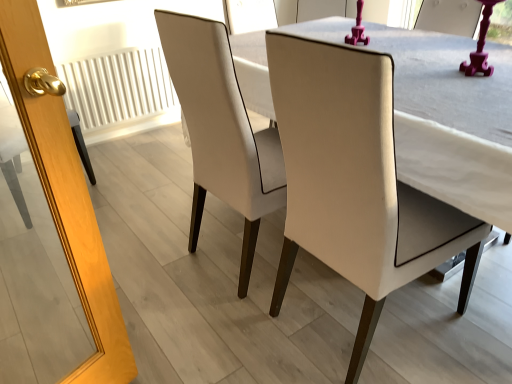
Question: Does point (73, 102) appear closer or farther from the camera than point (228, 152)?

Choices:
 (A) farther
 (B) closer

Answer: (A)

Question: From the image's perspective, is white textured radiator at left positioned above or below white leather chair at center, which is the 2th chair in right-to-left order?

Choices:
 (A) below
 (B) above

Answer: (B)

Question: Which is nearer to the white leather chair at center, arranged as the first chair when viewed from the left?

Choices:
 (A) matte white chair at center, which is counted as the 2th chair, starting from the left
 (B) white textured radiator at left

Answer: (A)

Question: Which is farther from the white textured radiator at left?

Choices:
 (A) matte white chair at center, the 1th chair in the right-to-left sequence
 (B) white leather chair at center, arranged as the first chair when viewed from the left

Answer: (A)